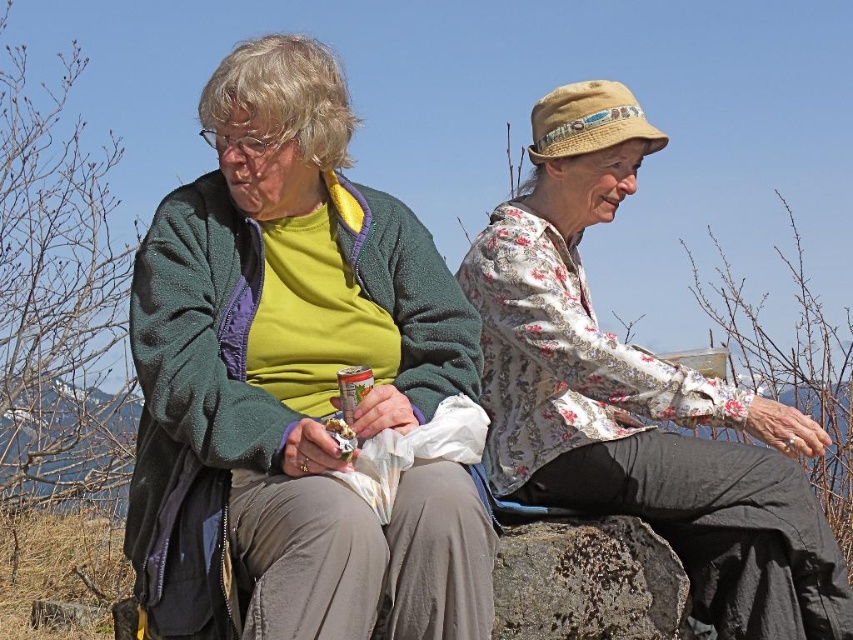
You are planning to take a photo of the two people in the scene. To ensure both the floral fabric blouse at upper right and the rusty stone boulder at center are clearly visible in the frame, which object should you focus on first, considering their sizes?

The floral fabric blouse at upper right has a larger size compared to the rusty stone boulder at center, so you should focus on the floral fabric blouse at upper right first to ensure both are in focus.

You are a photographer trying to capture a photo of the rusty stone boulder at center. However, the floral fabric blouse at upper right is blocking your view. Can you determine if the blouse is taller than the boulder?

The floral fabric blouse at upper right is taller than the rusty stone boulder at center, so it is blocking the view of the boulder.